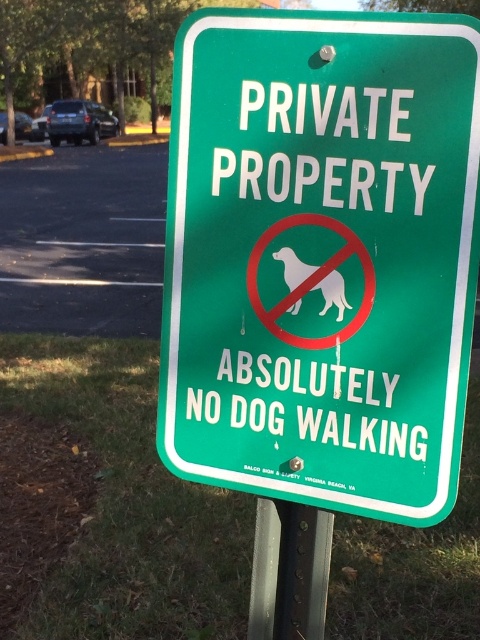
Measure the distance from green plastic sign at center to green metallic pole at lower center.

13.22 inches

Is point (301, 19) closer to camera compared to point (260, 564)?

Yes.

Is point (220, 468) positioned after point (288, 605)?

No, (220, 468) is in front of (288, 605).

Where is `green plastic sign at center`? This screenshot has height=640, width=480. green plastic sign at center is located at coordinates (322, 257).

Is green metallic pole at lower center thinner than white paper dog at center?

No.

Can you confirm if green metallic pole at lower center is wider than white paper dog at center?

Yes, green metallic pole at lower center is wider than white paper dog at center.

Does point (312, 538) lie behind point (333, 284)?

Yes, point (312, 538) is farther from viewer.

You are a GUI agent. You are given a task and a screenshot of the screen. Output one action in this format:
    pyautogui.click(x=<x>, y=<y>)
    Task: Click on the green metallic pole at lower center
    The width and height of the screenshot is (480, 640).
    Given the screenshot: What is the action you would take?
    pyautogui.click(x=288, y=570)

Can you confirm if green plastic sign at center is positioned below white paper dog at center?

Incorrect, green plastic sign at center is not positioned below white paper dog at center.

The image size is (480, 640). Describe the element at coordinates (322, 257) in the screenshot. I see `green plastic sign at center` at that location.

Identify the location of green plastic sign at center. This screenshot has height=640, width=480. click(x=322, y=257).